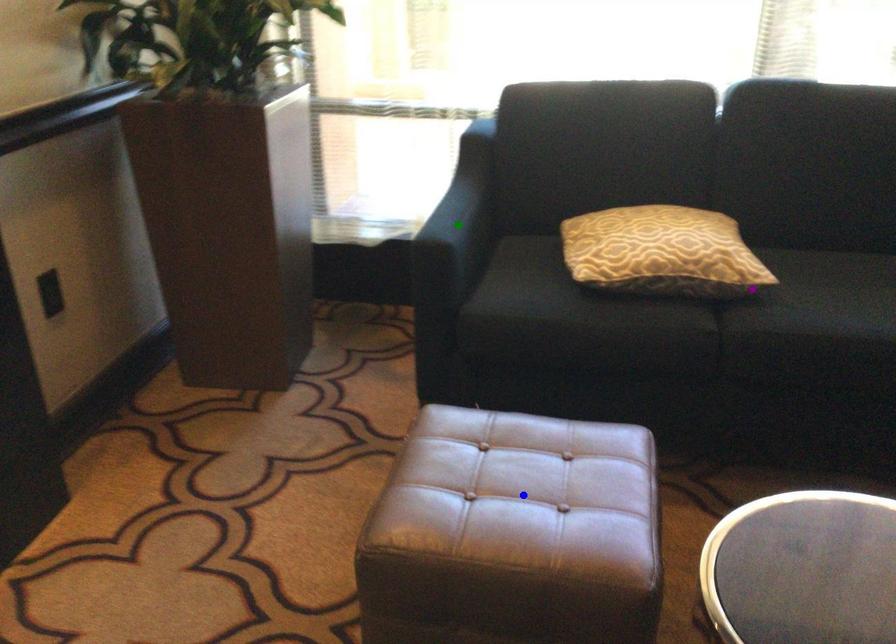
Order these from nearest to farthest:
purple point | blue point | green point

blue point, green point, purple point